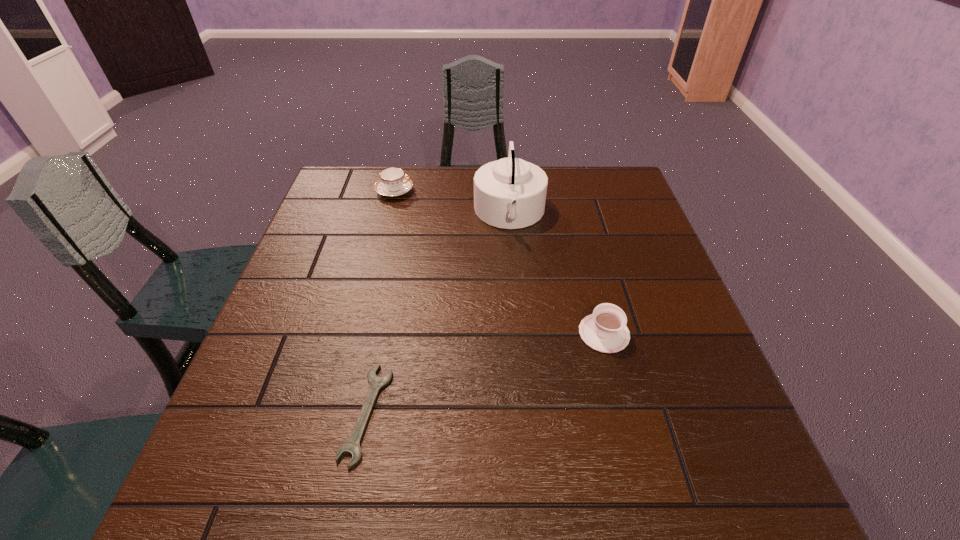
Identify the location of vacant space that is in between the farther teacup and the kettle. (452, 202).

In order to click on free space between the kettle and the shortest object in this screenshot , I will do `click(439, 313)`.

You are a GUI agent. You are given a task and a screenshot of the screen. Output one action in this format:
    pyautogui.click(x=<x>, y=<y>)
    Task: Click on the free spot between the left teacup and the nearest object
    
    Given the screenshot: What is the action you would take?
    pyautogui.click(x=381, y=302)

Identify the location of vacant area that lies between the wrench and the farther teacup. (381, 302).

Where is `free space that is in between the left teacup and the wrench`? This screenshot has width=960, height=540. free space that is in between the left teacup and the wrench is located at coordinates (381, 302).

Image resolution: width=960 pixels, height=540 pixels. What are the coordinates of `free spot between the third object from left to right and the rightmost object` in the screenshot? It's located at (557, 273).

You are a GUI agent. You are given a task and a screenshot of the screen. Output one action in this format:
    pyautogui.click(x=<x>, y=<y>)
    Task: Click on the object that stands as the second closest to the third object from left to right
    This screenshot has height=540, width=960.
    Given the screenshot: What is the action you would take?
    pyautogui.click(x=605, y=330)

Locate an element on the screen. Image resolution: width=960 pixels, height=540 pixels. object that is the closest to the nearer teacup is located at coordinates (510, 193).

Identify the location of vacant region that satisfies the following two spatial constraints: 1. on the handle side of the nearer teacup; 2. on the spout of the kettle. The height and width of the screenshot is (540, 960). (573, 213).

Locate an element on the screen. free spot that satisfies the following two spatial constraints: 1. on the handle side of the second nearest object; 2. on the spout of the kettle is located at coordinates (573, 213).